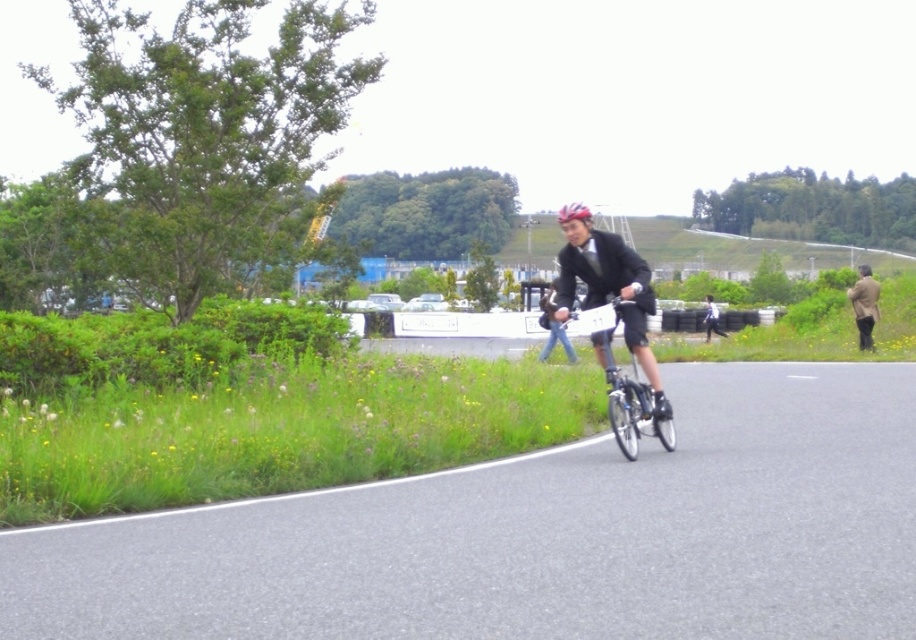
Does point (609, 394) come farther from viewer compared to point (578, 218)?

Yes.

This screenshot has width=916, height=640. What do you see at coordinates (629, 390) in the screenshot? I see `silver metallic bicycle at center` at bounding box center [629, 390].

The width and height of the screenshot is (916, 640). Find the location of `silver metallic bicycle at center`. silver metallic bicycle at center is located at coordinates (629, 390).

Which is below, brown leather jacket at right or shiny blue helmet at center?

brown leather jacket at right is lower down.

Is brown leather jacket at right to the right of shiny blue helmet at center from the viewer's perspective?

Correct, you'll find brown leather jacket at right to the right of shiny blue helmet at center.

Is point (867, 289) closer to camera compared to point (565, 218)?

No, it is behind (565, 218).

Where is `brown leather jacket at right`? This screenshot has width=916, height=640. brown leather jacket at right is located at coordinates pos(864,305).

Is matte black suit at center wider than shiny blue helmet at center?

No.

Is point (566, 317) behind point (558, 212)?

No.

Is point (568, 275) positioned behind point (559, 220)?

No, it is in front of (559, 220).

This screenshot has height=640, width=916. In order to click on matte black suit at center in this screenshot , I will do `click(611, 291)`.